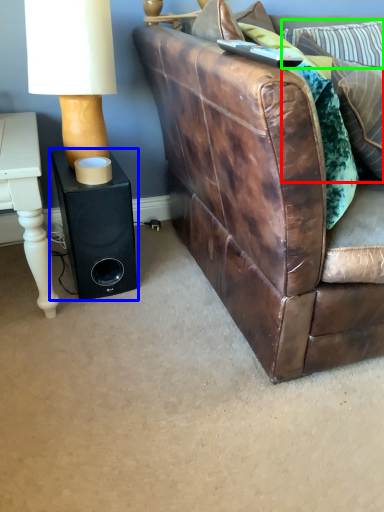
Question: Which is nearer to the pillow (highlighted by a red box)? speaker (highlighted by a blue box) or pillow (highlighted by a green box).

Choices:
 (A) speaker
 (B) pillow

Answer: (B)